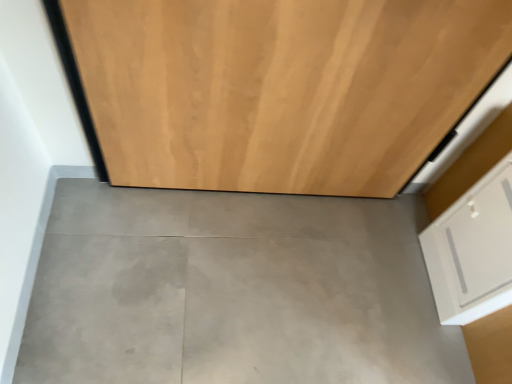
Question: In terms of size, does wooden door at center appear bigger or smaller than white matte drawer at lower right?

Choices:
 (A) big
 (B) small

Answer: (A)

Question: Would you say wooden door at center is inside or outside white matte drawer at lower right?

Choices:
 (A) outside
 (B) inside

Answer: (A)

Question: Which is nearer to the white matte drawer at lower right?

Choices:
 (A) wooden door at center
 (B) gray concrete floor at center

Answer: (B)

Question: Estimate the real-world distances between objects in this image. Which object is closer to the white matte drawer at lower right?

Choices:
 (A) wooden door at center
 (B) gray concrete floor at center

Answer: (B)